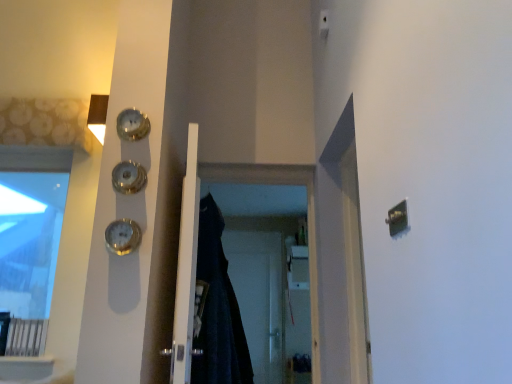
Question: Is white matte door at center inside the boundaries of gold metallic clock at left, which is the first clock in bottom-to-top order, or outside?

Choices:
 (A) outside
 (B) inside

Answer: (A)

Question: Considering the positions of white matte door at center and gold metallic clock at left, which ranks as the 3th clock in top-to-bottom order, in the image, is white matte door at center bigger or smaller than gold metallic clock at left, which ranks as the 3th clock in top-to-bottom order,?

Choices:
 (A) big
 (B) small

Answer: (A)

Question: Based on their relative distances, which object is farther from the transparent plastic screen door at center, which is counted as the second screen door, starting from the front?

Choices:
 (A) white matte door at center
 (B) transparent glass window at upper left
 (C) black fabric screen door at center, which appears as the second screen door when viewed from the back
 (D) metallic glass clock at upper left, marked as the 3th clock in a bottom-to-top arrangement
 (E) dark fabric robe at center

Answer: (D)

Question: Which object is positioned farthest from the metallic glass clock at upper left, marked as the 3th clock in a bottom-to-top arrangement?

Choices:
 (A) dark fabric robe at center
 (B) transparent glass window at upper left
 (C) transparent plastic screen door at center, placed as the 1th screen door when sorted from back to front
 (D) white matte door at center
 (E) shiny gold clock at upper left, which is the 2th clock in bottom-to-top order

Answer: (C)